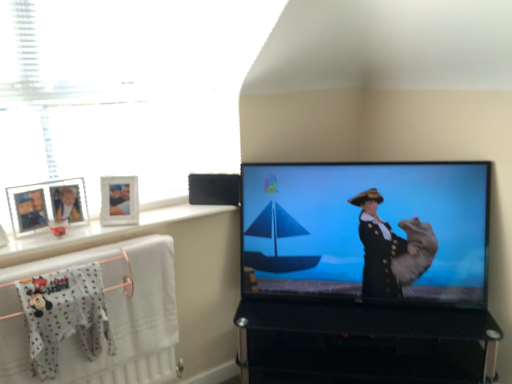
You are a GUI agent. You are given a task and a screenshot of the screen. Output one action in this format:
    pyautogui.click(x=<x>, y=<y>)
    Task: Click on the vacant area in front of white plastic picture frame at upper left
    
    Given the screenshot: What is the action you would take?
    pyautogui.click(x=34, y=241)